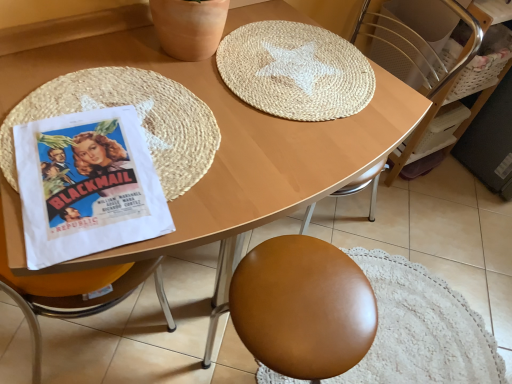
In order to click on vacant region to the right of woven straw placemat at left, the first mat from the left in this screenshot , I will do `click(285, 144)`.